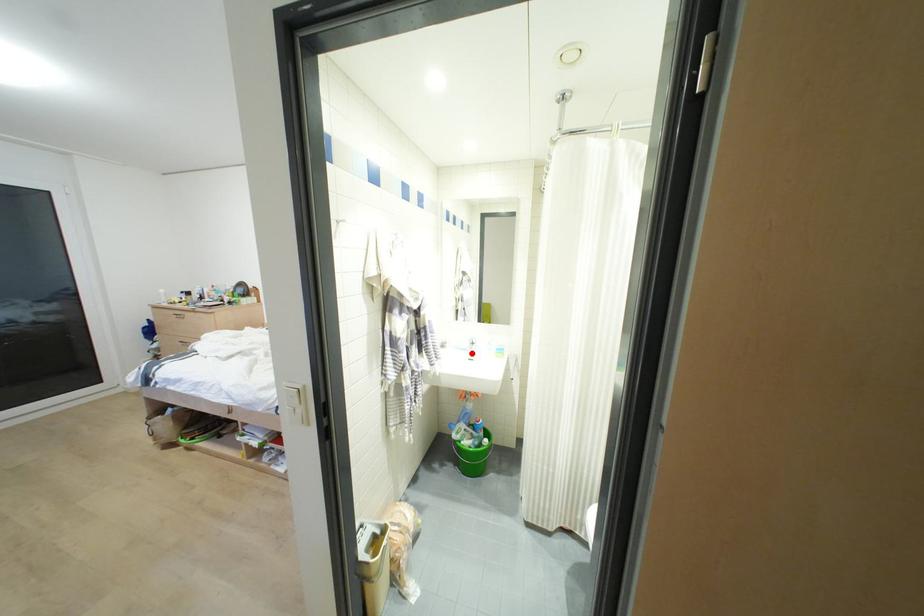
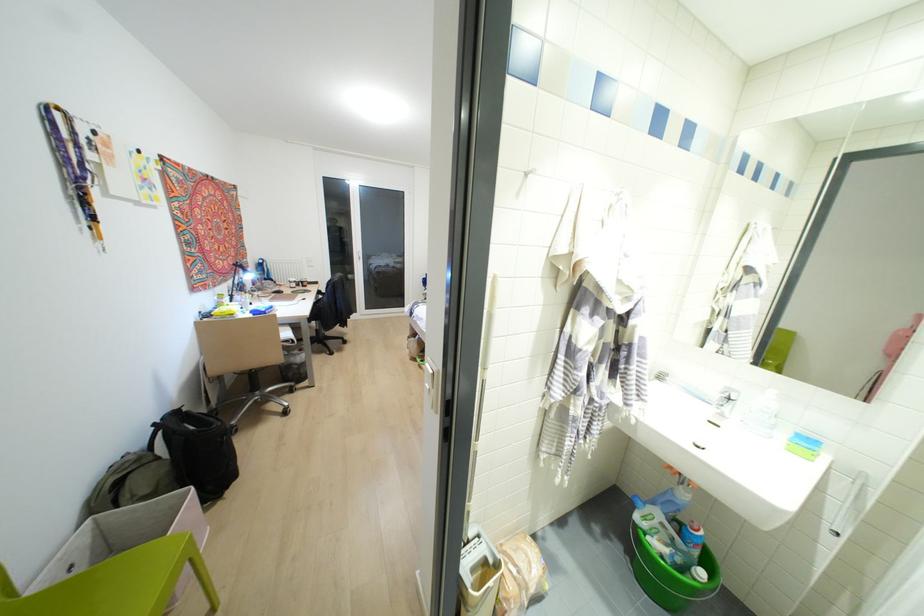
In the second image, find the point that corresponds to the highlighted location in the first image.

(721, 415)